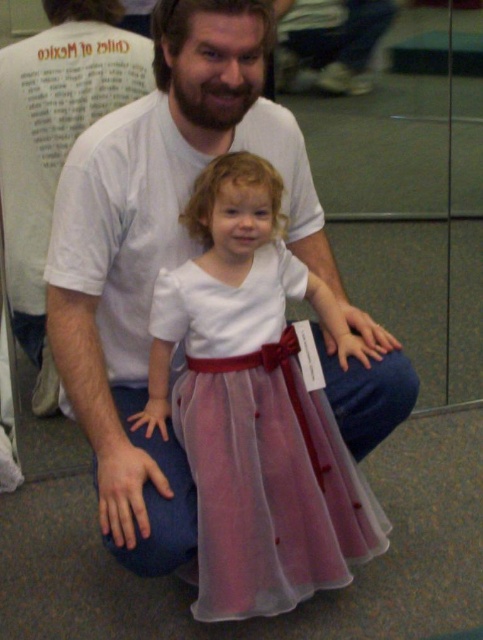
You are a photographer holding a camera. You want to take a photo of the scene. You are currently standing 1.19 meters away from the white cotton shirt at center. Is this distance sufficient to capture the entire scene in one shot?

The white cotton shirt at center and camera are 1.19 meters apart from each other. Whether this distance is sufficient depends on the camera lens and sensor size, but the question does not provide this information. Therefore, it is impossible to determine if the entire scene can be captured in one shot with the given distance.